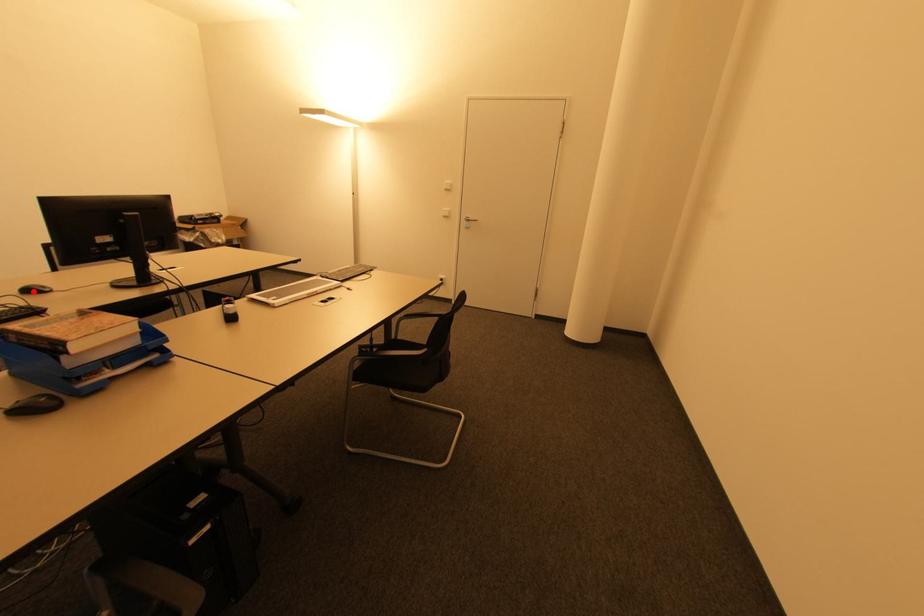
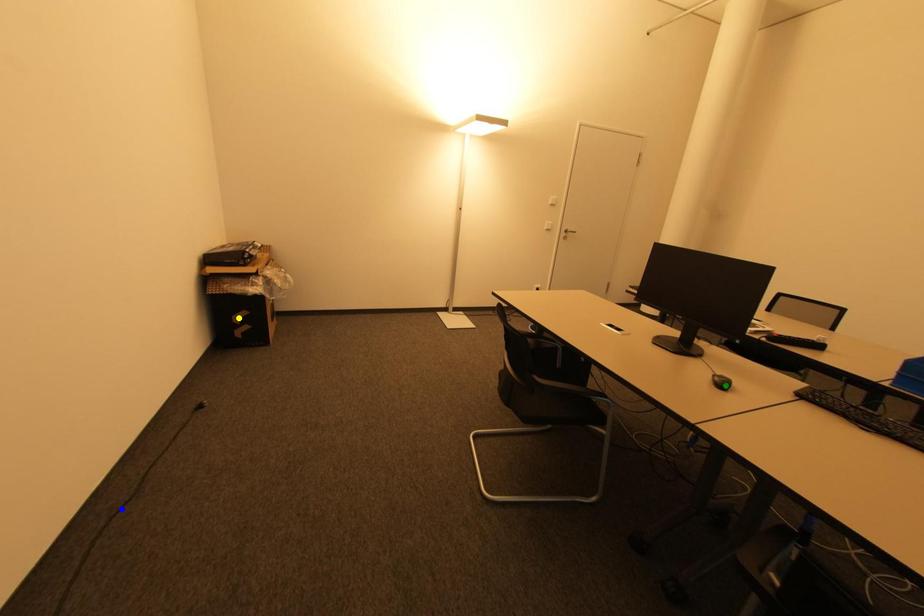
Question: I am providing you with two images of the same scene from different viewpoints. A red point is marked on the first image. You are given multiple points on the second image. Which point in image 2 represents the same 3d spot as the red point in image 1?

Choices:
 (A) blue point
 (B) green point
 (C) yellow point

Answer: (B)